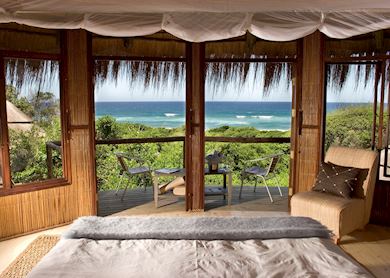
You are a GUI agent. You are given a task and a screenshot of the screen. Output one action in this format:
    pyautogui.click(x=<x>, y=<y>)
    Task: Click on the afghan
    Image resolution: width=390 pixels, height=278 pixels.
    Given the screenshot: What is the action you would take?
    pyautogui.click(x=149, y=224)